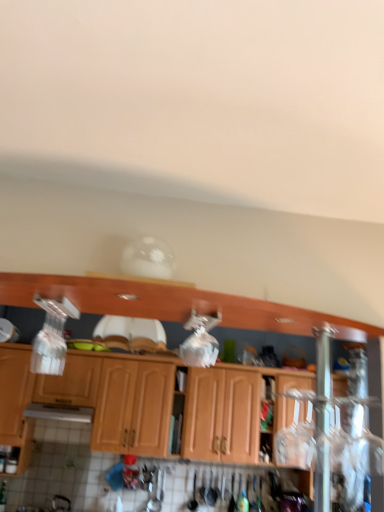
You are a GUI agent. You are given a task and a screenshot of the screen. Output one action in this format:
    pyautogui.click(x=<x>, y=<y>)
    Task: Click on the wooden cabinets at center, the first cabinetry in the front-to-back sequence
    The height and width of the screenshot is (512, 384).
    Given the screenshot: What is the action you would take?
    174,304

What is the approximate height of wooden cabinet at center, the 2th cabinetry positioned from the front?

wooden cabinet at center, the 2th cabinetry positioned from the front, is 32.37 inches tall.

What is the approximate height of wooden cabinet at center, the 1th cabinetry positioned from the back?

The height of wooden cabinet at center, the 1th cabinetry positioned from the back, is 32.37 inches.

Locate an element on the screen. The width and height of the screenshot is (384, 512). wooden cabinets at center, the first cabinetry in the front-to-back sequence is located at coordinates pyautogui.click(x=174, y=304).

Does wooden cabinet at center, the 2th cabinetry positioned from the front, have a larger size compared to wooden cabinets at center, the first cabinetry in the front-to-back sequence?

Yes, wooden cabinet at center, the 2th cabinetry positioned from the front, is bigger than wooden cabinets at center, the first cabinetry in the front-to-back sequence.

What's the angular difference between wooden cabinet at center, which is counted as the second cabinetry, starting from the back, and wooden cabinets at center, placed as the 3th cabinetry when sorted from back to front,'s facing directions?

The angular difference between wooden cabinet at center, which is counted as the second cabinetry, starting from the back, and wooden cabinets at center, placed as the 3th cabinetry when sorted from back to front, is 0.63 degrees.

From the image's perspective, relative to wooden cabinets at center, the first cabinetry in the front-to-back sequence, is wooden cabinet at center, the 2th cabinetry positioned from the front, above or below?

From the image's perspective, wooden cabinet at center, the 2th cabinetry positioned from the front, appears below wooden cabinets at center, the first cabinetry in the front-to-back sequence.

Find the location of `cabinetry lying on the left of wooden cabinets at center, placed as the 3th cabinetry when sorted from back to front`. cabinetry lying on the left of wooden cabinets at center, placed as the 3th cabinetry when sorted from back to front is located at coordinates (92, 398).

Considering the sizes of wooden cabinet at center, the 2th cabinetry positioned from the front, and wooden cabinet at center, the 3th cabinetry positioned from the front, in the image, is wooden cabinet at center, the 2th cabinetry positioned from the front, bigger or smaller than wooden cabinet at center, the 3th cabinetry positioned from the front,?

Clearly, wooden cabinet at center, the 2th cabinetry positioned from the front, is larger in size than wooden cabinet at center, the 3th cabinetry positioned from the front.

Which is in front, point (110, 446) or point (257, 454)?

The point (110, 446) is more forward.

Is wooden cabinet at center, which is counted as the second cabinetry, starting from the back, facing towards wooden cabinet at center, the 1th cabinetry positioned from the back?

No, wooden cabinet at center, which is counted as the second cabinetry, starting from the back, is not oriented towards wooden cabinet at center, the 1th cabinetry positioned from the back.

Is wooden cabinet at center, which is counted as the second cabinetry, starting from the back, behind wooden cabinet at center, the 1th cabinetry positioned from the back?

No, it is not.

Does wooden cabinets at center, the first cabinetry in the front-to-back sequence, lie behind wooden cabinet at center, the 3th cabinetry positioned from the front?

That is False.

Does wooden cabinets at center, the first cabinetry in the front-to-back sequence, contain wooden cabinet at center, the 1th cabinetry positioned from the back?

Definitely not — wooden cabinet at center, the 1th cabinetry positioned from the back, is not inside wooden cabinets at center, the first cabinetry in the front-to-back sequence.

From a real-world perspective, is wooden cabinets at center, placed as the 3th cabinetry when sorted from back to front, positioned above or below wooden cabinet at center, the 1th cabinetry positioned from the back?

wooden cabinets at center, placed as the 3th cabinetry when sorted from back to front, is above wooden cabinet at center, the 1th cabinetry positioned from the back.

Is wooden cabinets at center, placed as the 3th cabinetry when sorted from back to front, bigger or smaller than wooden cabinet at center, the 1th cabinetry positioned from the back?

In the image, wooden cabinets at center, placed as the 3th cabinetry when sorted from back to front, appears to be smaller than wooden cabinet at center, the 1th cabinetry positioned from the back.

How many degrees apart are the facing directions of wooden cabinet at center, the 1th cabinetry positioned from the back, and wooden cabinets at center, placed as the 3th cabinetry when sorted from back to front?

0.63 degrees.

From a real-world perspective, is wooden cabinet at center, the 3th cabinetry positioned from the front, physically above wooden cabinets at center, the first cabinetry in the front-to-back sequence?

No, from a real-world perspective, wooden cabinet at center, the 3th cabinetry positioned from the front, is not above wooden cabinets at center, the first cabinetry in the front-to-back sequence.

Is wooden cabinet at center, the 3th cabinetry positioned from the front, positioned in front of wooden cabinets at center, placed as the 3th cabinetry when sorted from back to front?

That is False.

Is point (219, 395) more distant than point (105, 297)?

Yes, it is.

Which object is wider, wooden cabinets at center, the first cabinetry in the front-to-back sequence, or wooden cabinet at center, the 2th cabinetry positioned from the front?

With larger width is wooden cabinets at center, the first cabinetry in the front-to-back sequence.

Can you confirm if wooden cabinets at center, the first cabinetry in the front-to-back sequence, is smaller than wooden cabinet at center, which is counted as the second cabinetry, starting from the back?

Yes.

Is wooden cabinets at center, placed as the 3th cabinetry when sorted from back to front, far away from wooden cabinet at center, the 2th cabinetry positioned from the front?

Indeed, wooden cabinets at center, placed as the 3th cabinetry when sorted from back to front, is not near wooden cabinet at center, the 2th cabinetry positioned from the front.

Is wooden cabinets at center, placed as the 3th cabinetry when sorted from back to front, further to the viewer compared to wooden cabinet at center, which is counted as the second cabinetry, starting from the back?

No.

From the picture: What's the angular difference between wooden cabinet at center, the 1th cabinetry positioned from the back, and wooden cabinet at center, the 2th cabinetry positioned from the front,'s facing directions?

wooden cabinet at center, the 1th cabinetry positioned from the back, and wooden cabinet at center, the 2th cabinetry positioned from the front, are facing 0.00014 degrees away from each other.

In the image, there is a wooden cabinet at center, which is counted as the second cabinetry, starting from the back. Where is `cabinetry below it (from the image's perspective)`? cabinetry below it (from the image's perspective) is located at coordinates (x=222, y=415).

In terms of size, does wooden cabinet at center, the 1th cabinetry positioned from the back, appear bigger or smaller than wooden cabinet at center, the 2th cabinetry positioned from the front?

wooden cabinet at center, the 1th cabinetry positioned from the back, is smaller than wooden cabinet at center, the 2th cabinetry positioned from the front.

Based on the photo, can you confirm if wooden cabinet at center, the 1th cabinetry positioned from the back, is positioned to the left of wooden cabinet at center, the 2th cabinetry positioned from the front?

No, wooden cabinet at center, the 1th cabinetry positioned from the back, is not to the left of wooden cabinet at center, the 2th cabinetry positioned from the front.

The image size is (384, 512). Find the location of `cabinetry in front of the wooden cabinet at center, which is counted as the second cabinetry, starting from the back`. cabinetry in front of the wooden cabinet at center, which is counted as the second cabinetry, starting from the back is located at coordinates (174, 304).

Starting from the wooden cabinet at center, the 1th cabinetry positioned from the back, which cabinetry is the 2nd one to the left? Please provide its 2D coordinates.

[(92, 398)]

Looking at the image, which one is located further to wooden cabinet at center, the 1th cabinetry positioned from the back, wooden cabinets at center, the first cabinetry in the front-to-back sequence, or wooden cabinet at center, which is counted as the second cabinetry, starting from the back?

wooden cabinets at center, the first cabinetry in the front-to-back sequence, lies further to wooden cabinet at center, the 1th cabinetry positioned from the back, than the other object.

Based on their spatial positions, is wooden cabinets at center, the first cabinetry in the front-to-back sequence, or wooden cabinet at center, the 3th cabinetry positioned from the front, closer to wooden cabinet at center, the 2th cabinetry positioned from the front?

wooden cabinet at center, the 3th cabinetry positioned from the front.

When comparing their distances from wooden cabinets at center, the first cabinetry in the front-to-back sequence, does wooden cabinet at center, which is counted as the second cabinetry, starting from the back, or wooden cabinet at center, the 1th cabinetry positioned from the back, seem closer?

The object closer to wooden cabinets at center, the first cabinetry in the front-to-back sequence, is wooden cabinet at center, which is counted as the second cabinetry, starting from the back.

When comparing their distances from wooden cabinets at center, the first cabinetry in the front-to-back sequence, does wooden cabinet at center, the 1th cabinetry positioned from the back, or wooden cabinet at center, which is counted as the second cabinetry, starting from the back, seem closer?

Among the two, wooden cabinet at center, which is counted as the second cabinetry, starting from the back, is located nearer to wooden cabinets at center, the first cabinetry in the front-to-back sequence.

Which object lies nearer to the anchor point wooden cabinet at center, which is counted as the second cabinetry, starting from the back, wooden cabinet at center, the 3th cabinetry positioned from the front, or wooden cabinets at center, placed as the 3th cabinetry when sorted from back to front?

wooden cabinet at center, the 3th cabinetry positioned from the front, is closer to wooden cabinet at center, which is counted as the second cabinetry, starting from the back.

When comparing their distances from wooden cabinet at center, the 1th cabinetry positioned from the back, does wooden cabinet at center, the 2th cabinetry positioned from the front, or wooden cabinets at center, the first cabinetry in the front-to-back sequence, seem closer?

Among the two, wooden cabinet at center, the 2th cabinetry positioned from the front, is located nearer to wooden cabinet at center, the 1th cabinetry positioned from the back.

Identify the location of cabinetry located between wooden cabinets at center, placed as the 3th cabinetry when sorted from back to front, and wooden cabinet at center, the 1th cabinetry positioned from the back, in the depth direction. This screenshot has height=512, width=384. (92, 398).